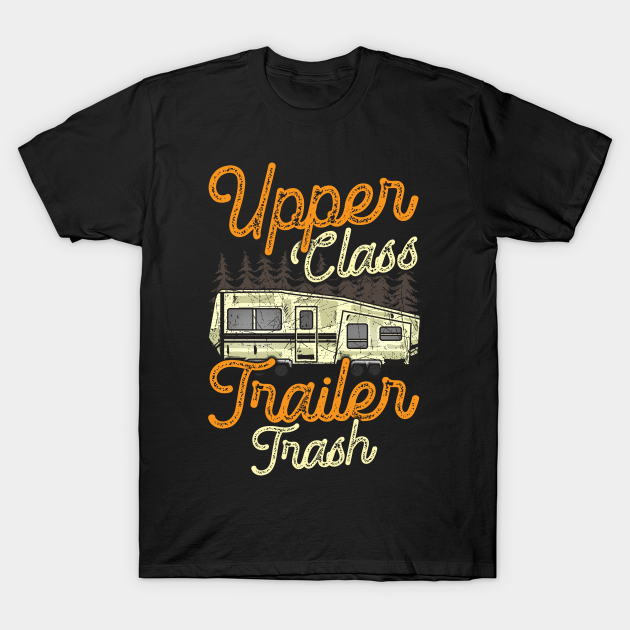
Image resolution: width=630 pixels, height=630 pixels. Find the location of `window`. window is located at coordinates (237, 319), (256, 319), (302, 321), (361, 333).